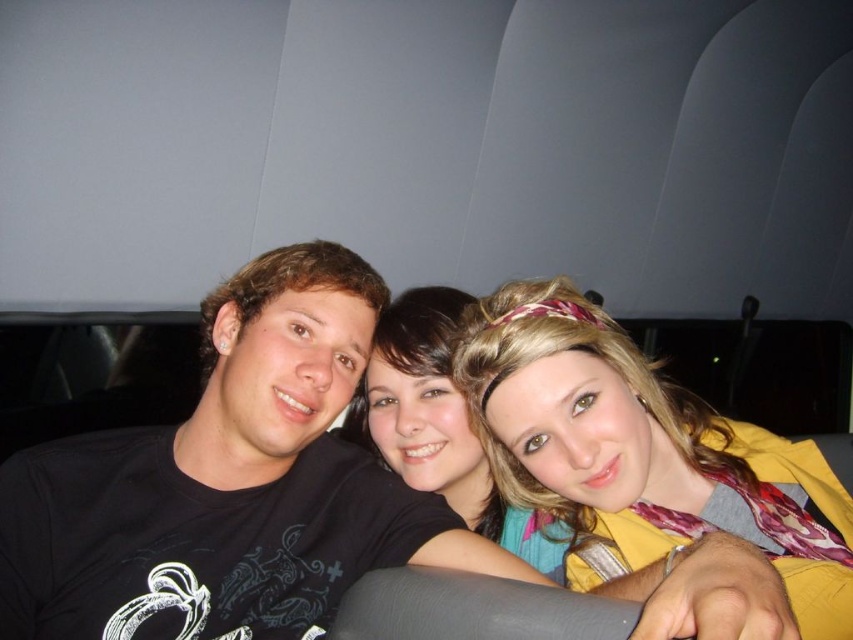
Question: Is yellow fabric headband at upper right wider than matte black shirt at center?

Choices:
 (A) no
 (B) yes

Answer: (B)

Question: Based on their relative distances, which object is nearer to the yellow fabric headband at upper right?

Choices:
 (A) matte black shirt at center
 (B) black cotton t-shirt at center

Answer: (A)

Question: Which point is closer to the camera taking this photo?

Choices:
 (A) (670, 547)
 (B) (386, 440)
 (C) (366, 502)

Answer: (A)

Question: Is yellow fabric headband at upper right smaller than matte black shirt at center?

Choices:
 (A) no
 (B) yes

Answer: (B)

Question: Does yellow fabric headband at upper right appear over matte black shirt at center?

Choices:
 (A) no
 (B) yes

Answer: (B)

Question: Which is nearer to the yellow fabric headband at upper right?

Choices:
 (A) matte black shirt at center
 (B) black cotton t-shirt at center

Answer: (A)